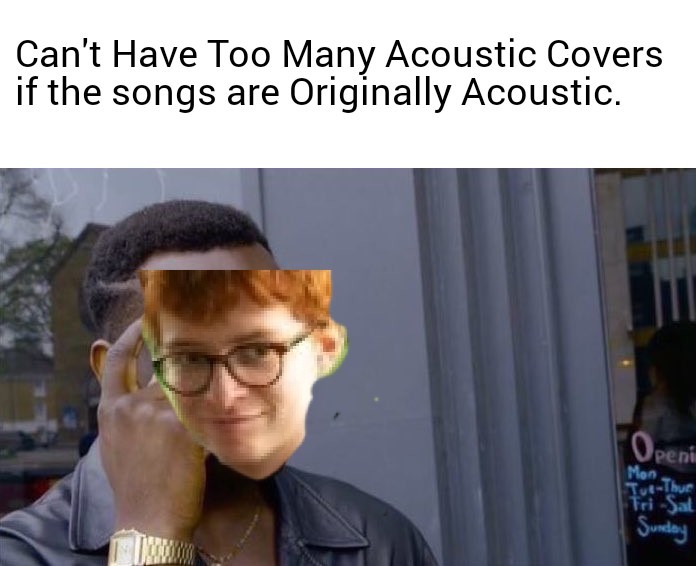
You are a GUI agent. You are given a task and a screenshot of the screen. Output one action in this format:
    pyautogui.click(x=<x>, y=<y>)
    Task: Click on the wall
    This screenshot has height=566, width=696.
    Given the screenshot: What is the action you would take?
    pyautogui.click(x=404, y=329)